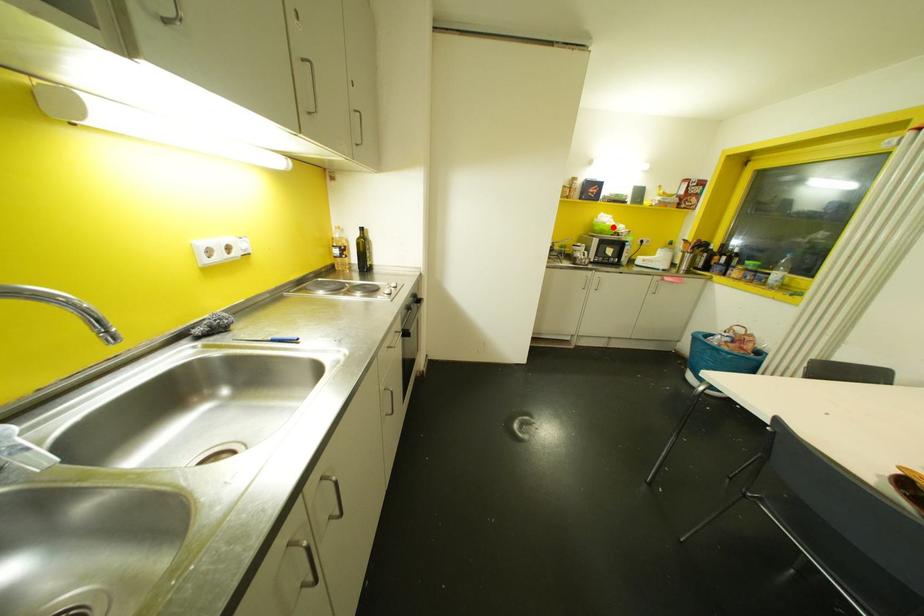
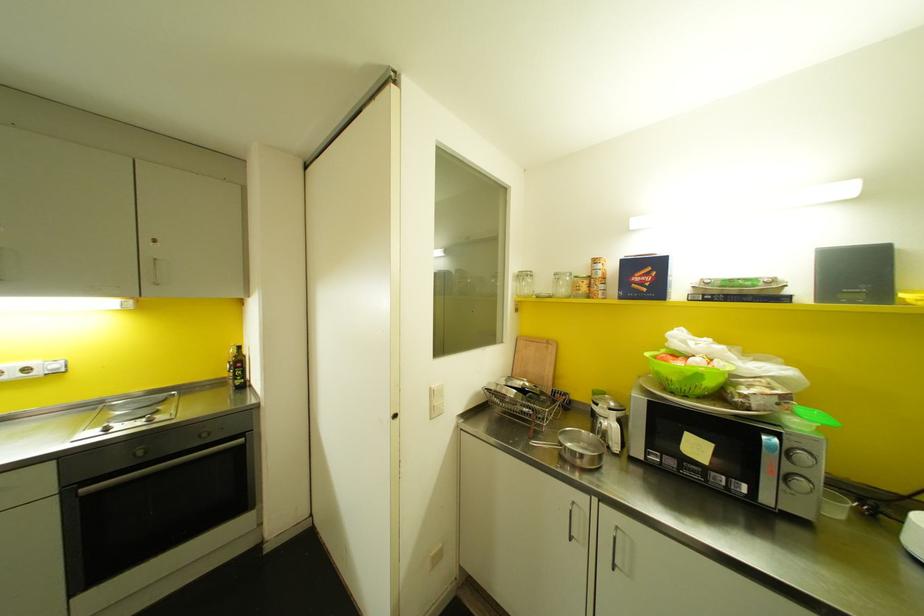
In the second image, find the point that corresponds to the highlighted location in the first image.

(698, 376)